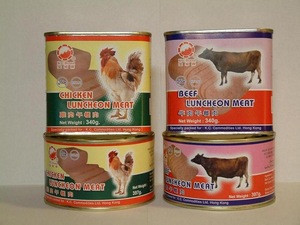
Locate an element on the screen. The image size is (300, 225). shelf is located at coordinates (160, 221).